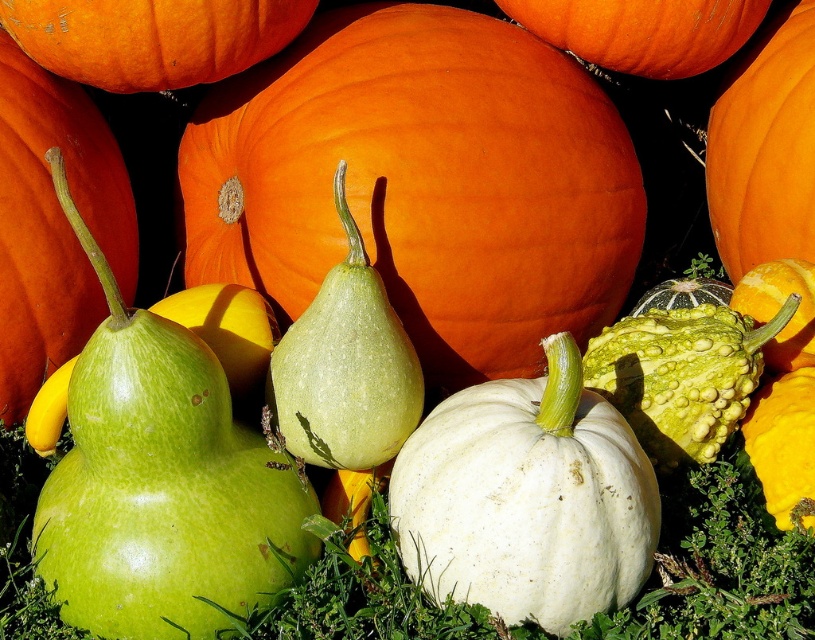
You are arranging a harvest display and need to know the vertical positioning of the pumpkins. Which one is placed higher in the image, the orange matte pumpkin at center or the white matte pumpkin at center?

The orange matte pumpkin at center is above the white matte pumpkin at center, so it is placed higher in the image.

You are standing at the point marked as point (525, 52) and want to walk to the entrance of the display area. The entrance is located 5 feet away from your current position. Can you reach the entrance without moving more than 5.06 feet?

Yes, because the entrance is only 5 feet away, which is within the 5.06 feet distance you can move.